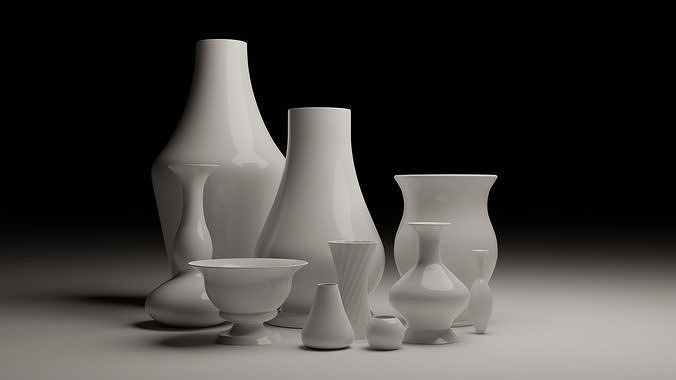
The height and width of the screenshot is (380, 676). Identify the location of 10 vase. (218, 131), (324, 196), (448, 211), (209, 198), (262, 303), (391, 337), (359, 264), (341, 327), (435, 288), (483, 313).